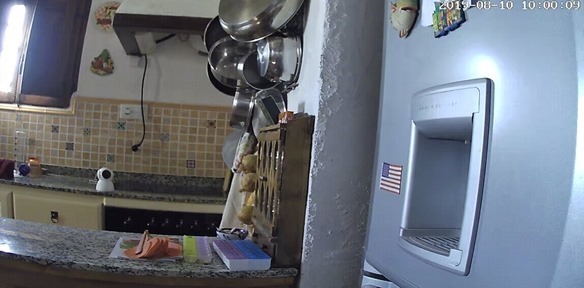
The image size is (584, 288). I want to click on security camera, so click(x=104, y=179).